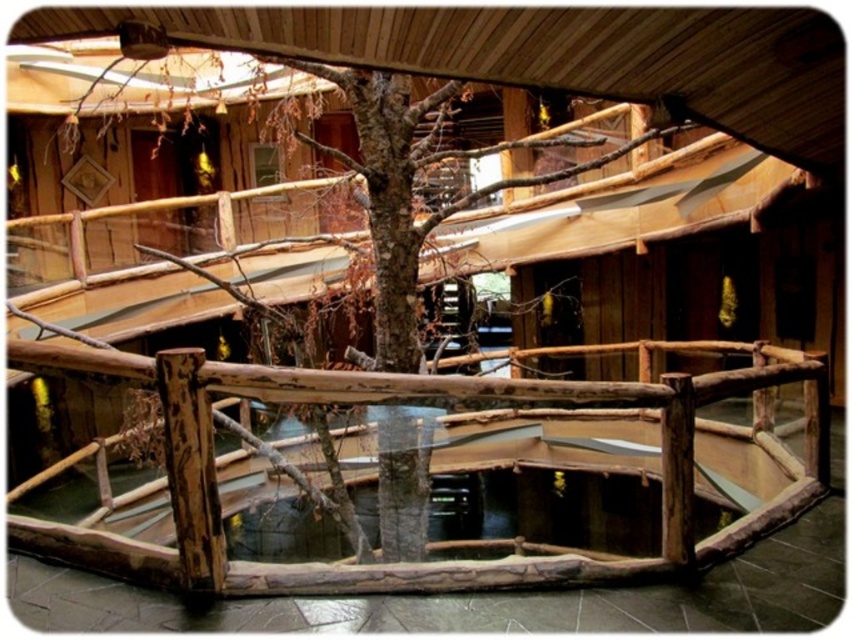
Between natural wood railing at center and brown rough wood tree at center, which one appears on the left side from the viewer's perspective?

From the viewer's perspective, natural wood railing at center appears more on the left side.

Who is more distant from viewer, [349,451] or [297,337]?

Positioned behind is point [349,451].

The height and width of the screenshot is (640, 853). I want to click on natural wood railing at center, so click(456, 467).